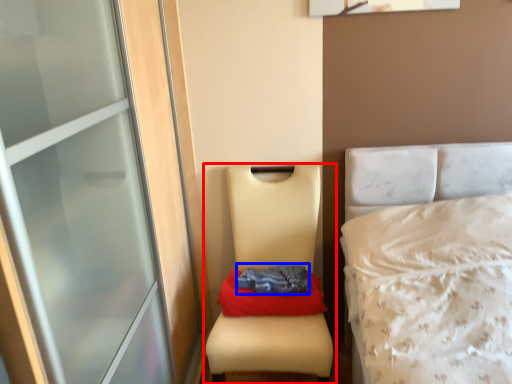
Question: Which point is closer to the camera, furniture (highlighted by a red box) or clothing (highlighted by a blue box)?

Choices:
 (A) furniture
 (B) clothing

Answer: (A)